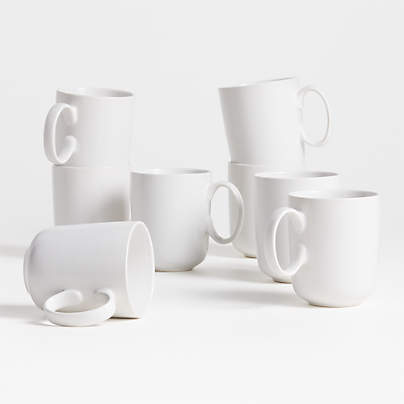
You are a GUI agent. You are given a task and a screenshot of the screen. Output one action in this format:
    pyautogui.click(x=<x>, y=<y>)
    Task: Click on the handles
    The height and width of the screenshot is (404, 404).
    Given the screenshot: What is the action you would take?
    click(x=55, y=112), click(x=52, y=303), click(x=238, y=199), click(x=276, y=228), click(x=322, y=136)